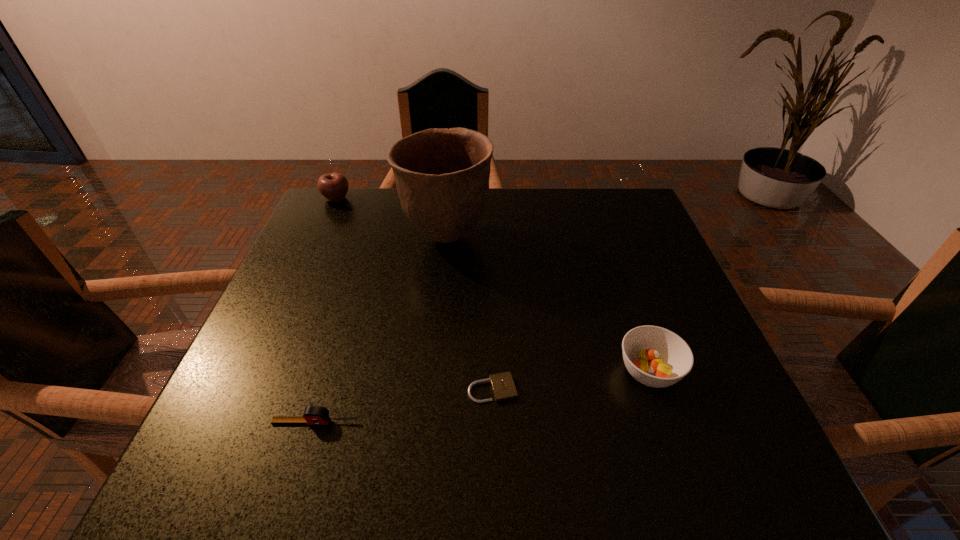
At what (x,y) coordinates should I click in order to perform the action: click on free space located 0.150m on the side of the farthest object with the unique marking. Please return your answer as a coordinate pair (x, y). The width and height of the screenshot is (960, 540). Looking at the image, I should click on pos(402,198).

Find the location of a particular element. free space located 0.310m on the back of the third tallest object is located at coordinates (607, 249).

What are the coordinates of `free space located on the back of the tape measure` in the screenshot? It's located at (328, 378).

Find the location of a particular element. free region located 0.160m on the back of the shortest object is located at coordinates (491, 313).

This screenshot has height=540, width=960. What are the coordinates of `pottery at the far edge` in the screenshot? It's located at (442, 176).

This screenshot has height=540, width=960. I want to click on apple that is positioned at the far edge, so point(333,187).

The image size is (960, 540). What are the coordinates of `apple present at the left edge` in the screenshot? It's located at (333, 187).

Where is `tape measure located at the left edge`? The image size is (960, 540). tape measure located at the left edge is located at coordinates (312, 415).

This screenshot has width=960, height=540. Identify the location of object present at the right edge. (656, 357).

Find the location of `object present at the far left corner`. object present at the far left corner is located at coordinates (333, 187).